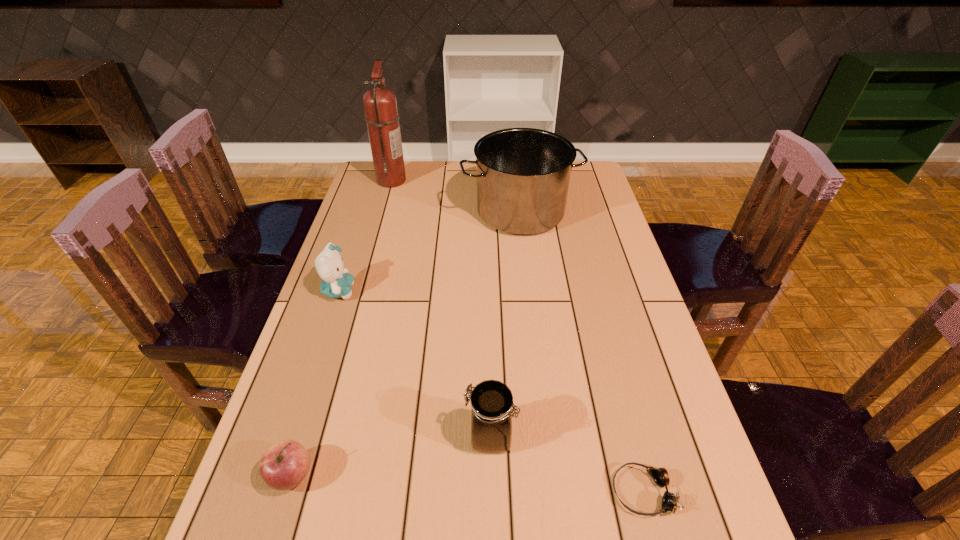
Where is `the tallest object`? the tallest object is located at coordinates (380, 106).

Find the location of a particular element. The height and width of the screenshot is (540, 960). saucepan is located at coordinates (523, 174).

The height and width of the screenshot is (540, 960). I want to click on jar, so click(x=491, y=401).

Identify the location of kitten. This screenshot has width=960, height=540. (337, 283).

Identify the location of the second shortest object. The width and height of the screenshot is (960, 540). (284, 465).

At what (x,y) coordinates should I click in order to perform the action: click on the shortest object. Please return your answer as a coordinate pair (x, y). Looking at the image, I should click on 660,475.

Image resolution: width=960 pixels, height=540 pixels. In order to click on vacant space located on the front-facing side of the fire extinguisher in this screenshot , I will do point(467,180).

Find the location of a particular element. The image size is (960, 540). vacant region located 0.140m on the left of the second tallest object is located at coordinates (421, 212).

The height and width of the screenshot is (540, 960). I want to click on free point located on the lid of the jar, so click(x=281, y=437).

Identify the location of vacant space situated 0.090m on the lid of the jar. (422, 437).